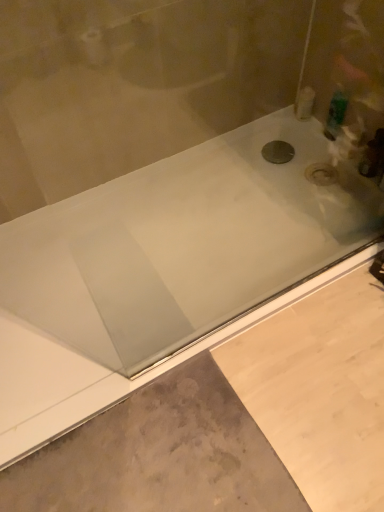
Question: Are white plastic bottle at upper right, arranged as the first toiletry when viewed from the left, and gray concrete at lower left beside each other?

Choices:
 (A) yes
 (B) no

Answer: (B)

Question: Does white plastic bottle at upper right, arranged as the first toiletry when viewed from the left, have a lesser width compared to gray concrete at lower left?

Choices:
 (A) no
 (B) yes

Answer: (B)

Question: Does white plastic bottle at upper right, arranged as the second toiletry when viewed from the right, have a smaller size compared to gray concrete at lower left?

Choices:
 (A) no
 (B) yes

Answer: (B)

Question: Is there a large distance between white plastic bottle at upper right, arranged as the second toiletry when viewed from the right, and gray concrete at lower left?

Choices:
 (A) yes
 (B) no

Answer: (A)

Question: Could you tell me if white plastic bottle at upper right, arranged as the second toiletry when viewed from the right, is turned towards gray concrete at lower left?

Choices:
 (A) no
 (B) yes

Answer: (A)

Question: Is the position of white plastic bottle at upper right, arranged as the first toiletry when viewed from the left, more distant than that of gray concrete at lower left?

Choices:
 (A) yes
 (B) no

Answer: (A)

Question: From the image's perspective, is green plastic bottle at upper right, which is the first toiletry in right-to-left order, over white plastic bottle at upper right, arranged as the first toiletry when viewed from the left?

Choices:
 (A) no
 (B) yes

Answer: (A)

Question: Can you confirm if green plastic bottle at upper right, which is the first toiletry in right-to-left order, is positioned to the left of white plastic bottle at upper right, arranged as the second toiletry when viewed from the right?

Choices:
 (A) yes
 (B) no

Answer: (B)

Question: Is the depth of green plastic bottle at upper right, which is the first toiletry in right-to-left order, greater than that of white plastic bottle at upper right, arranged as the first toiletry when viewed from the left?

Choices:
 (A) no
 (B) yes

Answer: (A)

Question: Is green plastic bottle at upper right, which is counted as the 2th toiletry, starting from the left, far away from white plastic bottle at upper right, arranged as the second toiletry when viewed from the right?

Choices:
 (A) yes
 (B) no

Answer: (B)

Question: Considering the relative sizes of green plastic bottle at upper right, which is the first toiletry in right-to-left order, and white plastic bottle at upper right, arranged as the first toiletry when viewed from the left, in the image provided, is green plastic bottle at upper right, which is the first toiletry in right-to-left order, smaller than white plastic bottle at upper right, arranged as the first toiletry when viewed from the left,?

Choices:
 (A) yes
 (B) no

Answer: (B)

Question: Can you confirm if green plastic bottle at upper right, which is the first toiletry in right-to-left order, is thinner than white plastic bottle at upper right, arranged as the first toiletry when viewed from the left?

Choices:
 (A) no
 (B) yes

Answer: (B)

Question: From a real-world perspective, is white plastic bottle at upper right, arranged as the second toiletry when viewed from the right, below black metallic drain at center?

Choices:
 (A) yes
 (B) no

Answer: (B)